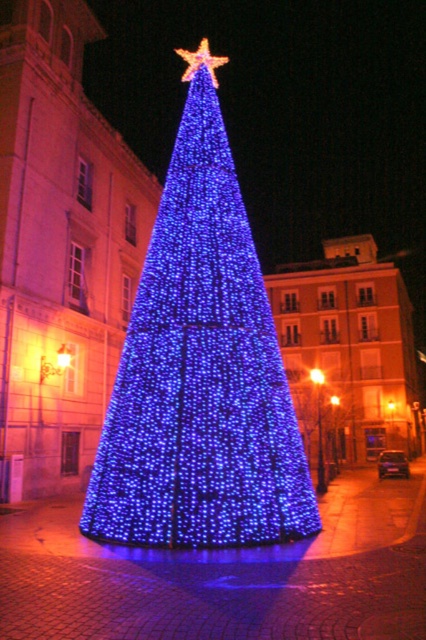
You are standing in the town square at night, looking at the Christmas tree. You notice the gold metallic star at upper center and the bright orange light at center. How far apart are these two lights in feet?

The gold metallic star at upper center and the bright orange light at center are 268.61 feet apart from each other.